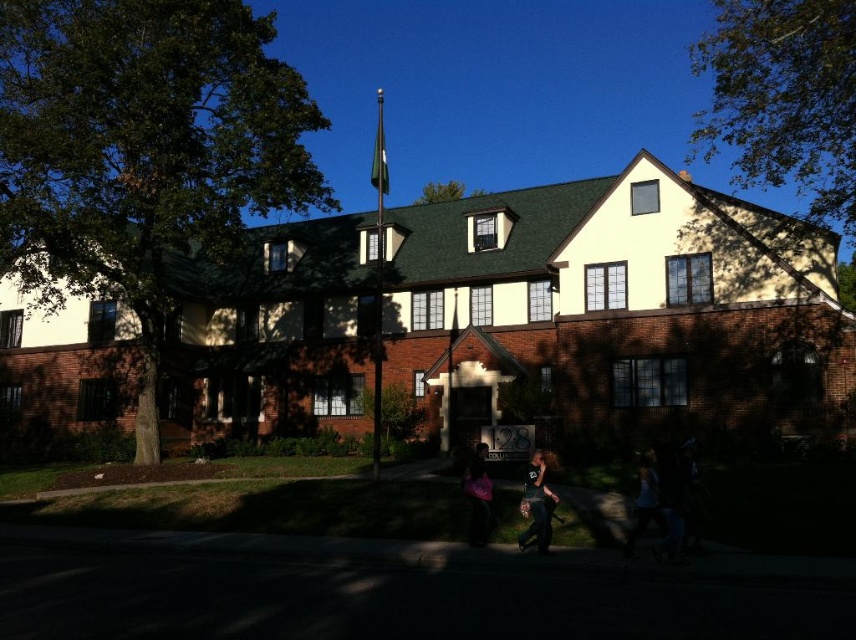
You are a delivery person who needs to determine which item is closer to the ground between the pink fabric bag at lower center and the white tank top at lower right. Based on their positions, which one is lower?

The pink fabric bag at lower center is shorter than the white tank top at lower right, so the pink fabric bag at lower center is closer to the ground.

You are standing in front of the two story building and see a pink fabric bag at lower center and a white tank top at lower right. Which item is positioned more to the left side?

The pink fabric bag at lower center is positioned more to the left side than the white tank top at lower right.